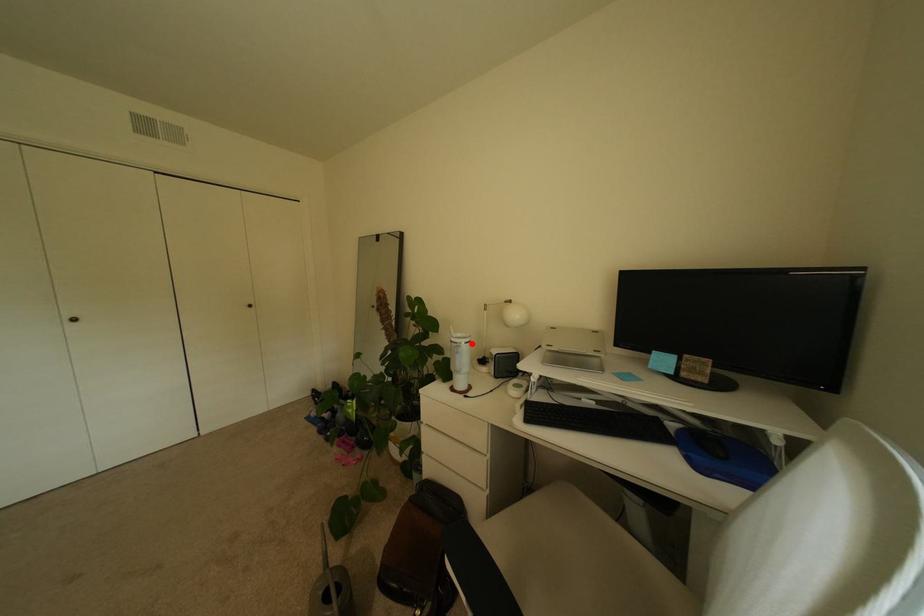
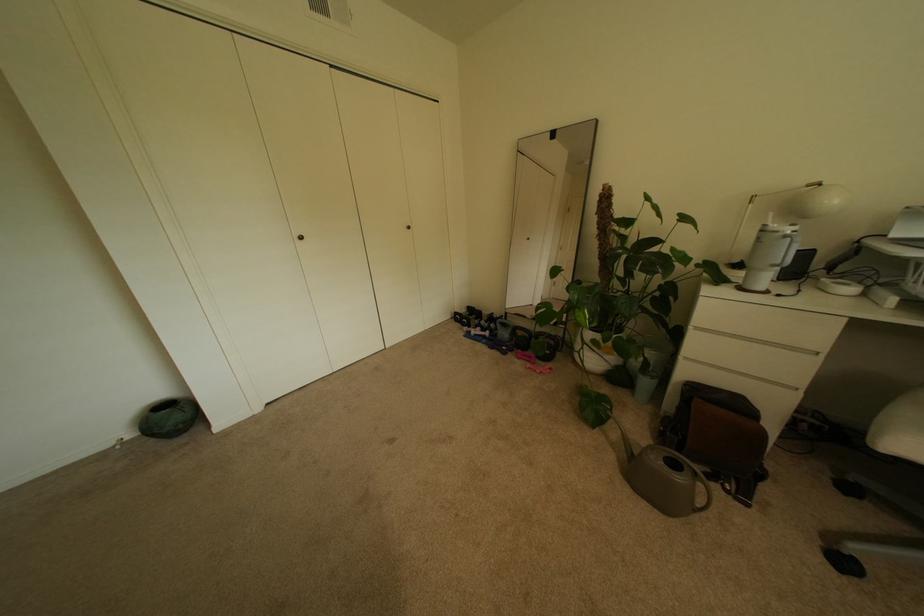
In the second image, find the point that corresponds to the highlighted location in the first image.

(796, 233)